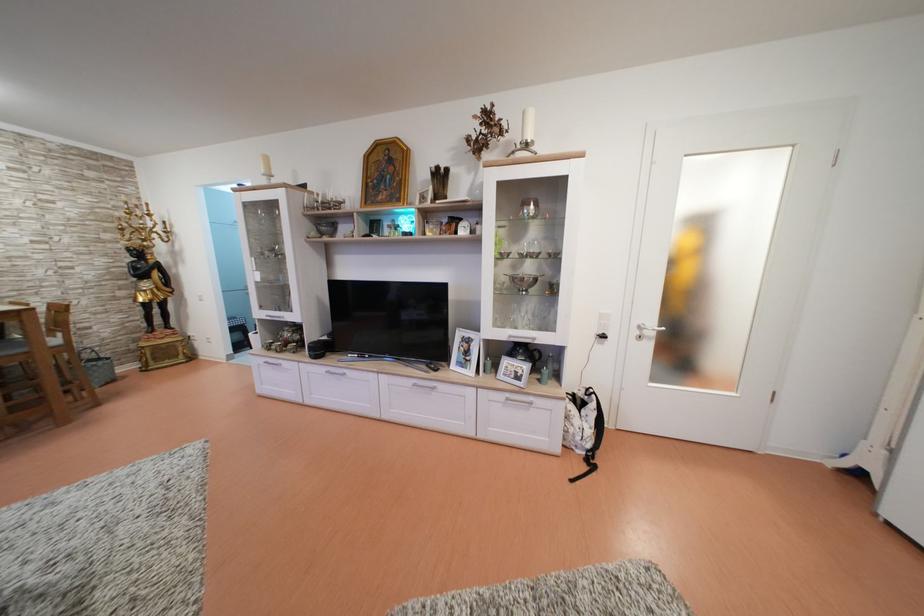
This screenshot has height=616, width=924. I want to click on chair sitting surface, so [22, 345].